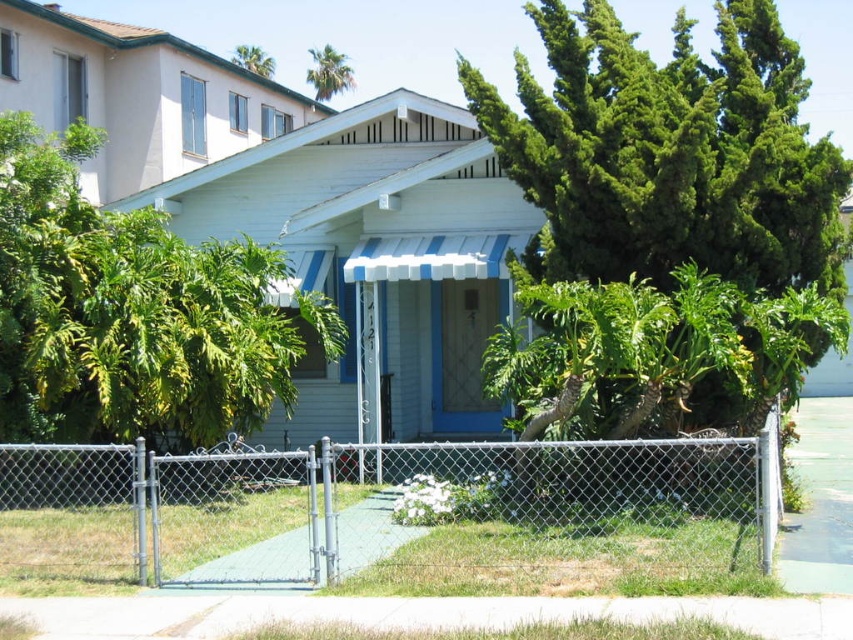
Question: Which point is closer to the camera?

Choices:
 (A) (457, 513)
 (B) (136, 268)
 (C) (242, 56)

Answer: (A)

Question: Does metallic silver fence at lower left have a greater width compared to green leafy tree at upper center?

Choices:
 (A) no
 (B) yes

Answer: (A)

Question: Which of the following is the farthest from the observer?

Choices:
 (A) metallic silver fence at lower left
 (B) green leafy tree at center
 (C) green leafy tree at upper center
 (D) green leafy palm tree at upper center

Answer: (D)

Question: Is metallic silver fence at lower left wider than green leafy tree at left?

Choices:
 (A) yes
 (B) no

Answer: (B)

Question: Among these points, which one is nearest to the camera?

Choices:
 (A) (225, 506)
 (B) (618, 42)
 (C) (340, 84)
 (D) (254, 67)

Answer: (A)

Question: Can you confirm if green leafy tree at center is positioned above green leafy tree at upper center?

Choices:
 (A) yes
 (B) no

Answer: (B)